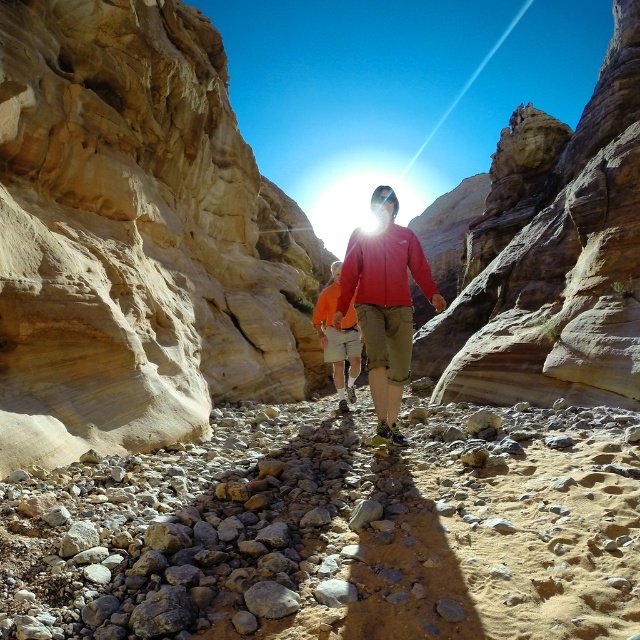
You are one of the hikers wearing the matte red jacket at center. You want to move to the smooth sandstone rock at center to take a break. Which direction should you walk to reach it?

The smooth sandstone rock at center is to the right of the matte red jacket at center, so you should walk to your right to reach it.

You are a hiker trying to cross the narrow canyon. You see two rocks in the center of your path, the smooth beige rock at center and the smooth sandstone rock at center. Which rock should you step on if you want to avoid the larger one?

You should step on the smooth beige rock at center because it is smaller than the smooth sandstone rock at center, so avoiding the larger one means choosing the smaller one.

You are a hiker who wants to place a small backpack on the ground near the smooth beige rock at center. Based on the scene description, where exactly should you place the backpack to ensure it stays stable?

Place the backpack on the ground near the smooth beige rock at center at point (136, 236). This location is stable because the ground around it is covered with small pebbles and larger stones, providing a firm base for the backpack to stay in place.